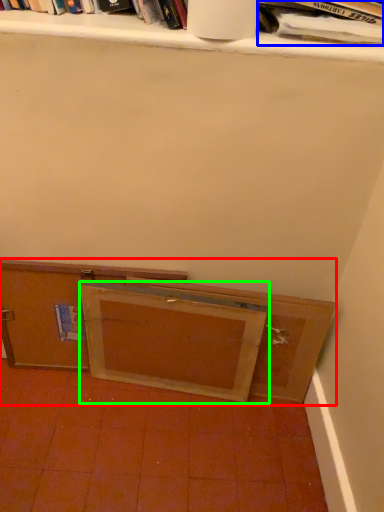
Question: Estimate the real-world distances between objects in this image. Which object is closer to cabinetry (highlighted by a red box), book (highlighted by a blue box) or wide (highlighted by a green box)?

Choices:
 (A) book
 (B) wide

Answer: (B)